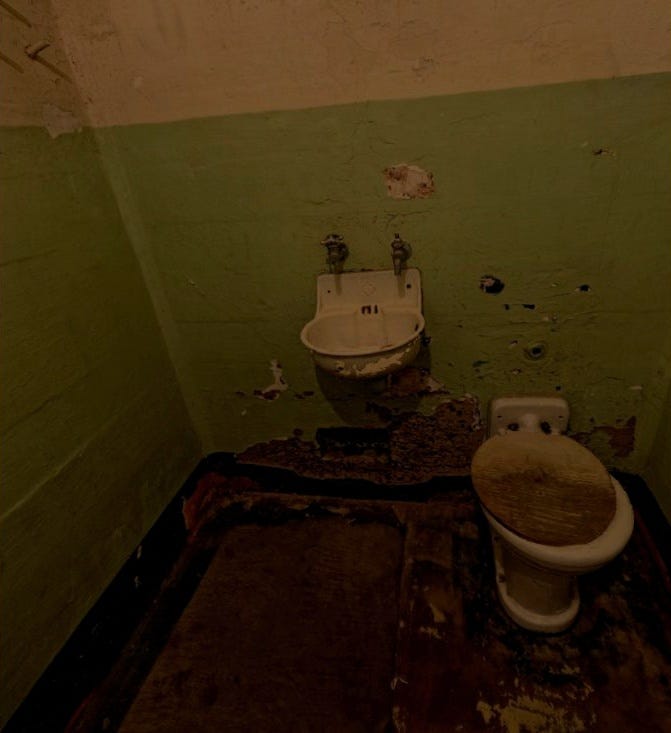
Locate an element on the screen. The image size is (671, 733). base of toilet is located at coordinates (541, 616).